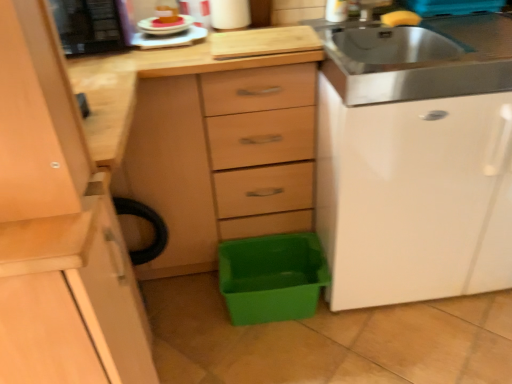
Question: Does matte wood chest of drawers at center have a larger size compared to stainless steel sink at upper right?

Choices:
 (A) yes
 (B) no

Answer: (A)

Question: Is matte wood chest of drawers at center to the right of stainless steel sink at upper right from the viewer's perspective?

Choices:
 (A) yes
 (B) no

Answer: (B)

Question: From a real-world perspective, is matte wood chest of drawers at center physically below stainless steel sink at upper right?

Choices:
 (A) yes
 (B) no

Answer: (A)

Question: Is matte wood chest of drawers at center facing away from stainless steel sink at upper right?

Choices:
 (A) no
 (B) yes

Answer: (A)

Question: Is matte wood chest of drawers at center taller than stainless steel sink at upper right?

Choices:
 (A) no
 (B) yes

Answer: (B)

Question: Does matte wood chest of drawers at center have a lesser width compared to stainless steel sink at upper right?

Choices:
 (A) yes
 (B) no

Answer: (B)

Question: Does yellow sponge at upper right, which ranks as the 2th food in left-to-right order, appear on the left side of pink frosted cake at upper left, positioned as the 1th food in left-to-right order?

Choices:
 (A) no
 (B) yes

Answer: (A)

Question: Is yellow sponge at upper right, which ranks as the 1th food in right-to-left order, thinner than pink frosted cake at upper left, positioned as the 1th food in left-to-right order?

Choices:
 (A) no
 (B) yes

Answer: (B)

Question: Does yellow sponge at upper right, which ranks as the 2th food in left-to-right order, contain pink frosted cake at upper left, positioned as the 1th food in left-to-right order?

Choices:
 (A) yes
 (B) no

Answer: (B)

Question: Considering the relative sizes of yellow sponge at upper right, which ranks as the 2th food in left-to-right order, and pink frosted cake at upper left, placed as the second food when sorted from right to left, in the image provided, is yellow sponge at upper right, which ranks as the 2th food in left-to-right order, smaller than pink frosted cake at upper left, placed as the second food when sorted from right to left,?

Choices:
 (A) no
 (B) yes

Answer: (A)

Question: From the image's perspective, is yellow sponge at upper right, which ranks as the 1th food in right-to-left order, above pink frosted cake at upper left, placed as the second food when sorted from right to left?

Choices:
 (A) no
 (B) yes

Answer: (B)

Question: Is yellow sponge at upper right, which ranks as the 1th food in right-to-left order, to the right of pink frosted cake at upper left, placed as the second food when sorted from right to left, from the viewer's perspective?

Choices:
 (A) no
 (B) yes

Answer: (B)

Question: From a real-world perspective, is stainless steel sink at upper right on white glossy plate at upper center, which is the first appliance from right to left?

Choices:
 (A) yes
 (B) no

Answer: (B)